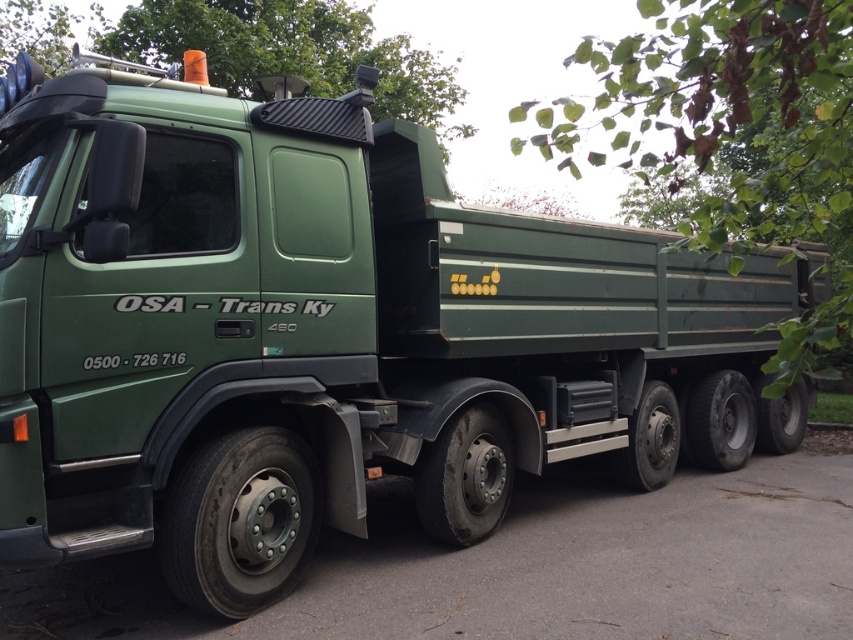
You are standing in front of the green matte truck at center and want to look at the green corrugated metal roof at upper center. In which direction should you turn your head?

You should turn your head to the left to see the green corrugated metal roof at upper center, since the green matte truck at center is positioned to the right of it.

You are standing at the point marked as point (738, 204). The large green dump truck is parked in front of you. If you want to walk around to the back of the truck, which direction should you move relative to your current position?

Since you are at point (738, 204) and the truck is parked in front of you, you should move to your left or right to go around the truck to the back.

You are a delivery driver who needs to park your truck in a tight space. You see the green matte truck at center and the green corrugated metal roof at upper center. Which object takes up more space in the parking area?

The green matte truck at center is bigger than the green corrugated metal roof at upper center, so the green matte truck at center takes up more space in the parking area.